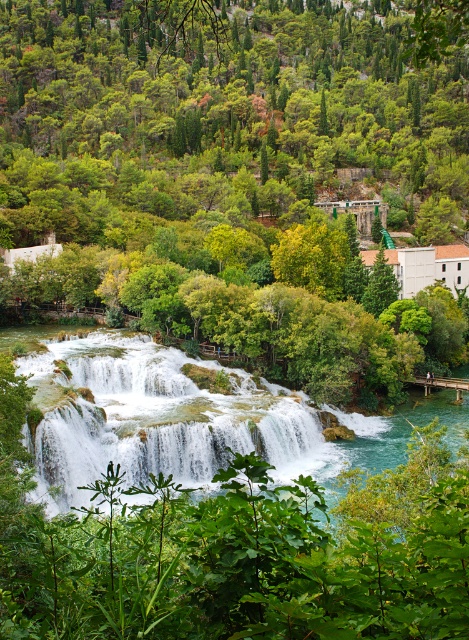
You are a hiker standing on the wooden walkway and want to take a photo of both the green leafy tree at center and the white frothy water at center. Which object should you position to your left side in the camera frame to include both in the shot?

The green leafy tree at center is to the left of white frothy water at center, so you should position the green leafy tree at center to your left side in the camera frame to include both in the shot.

You are a hiker standing on the wooden walkway and want to take a photo of both the green leafy tree at center and the white frothy water at center. Which object will appear taller in your photo?

The green leafy tree at center will appear taller in the photo because it has a greater height compared to the white frothy water at center.